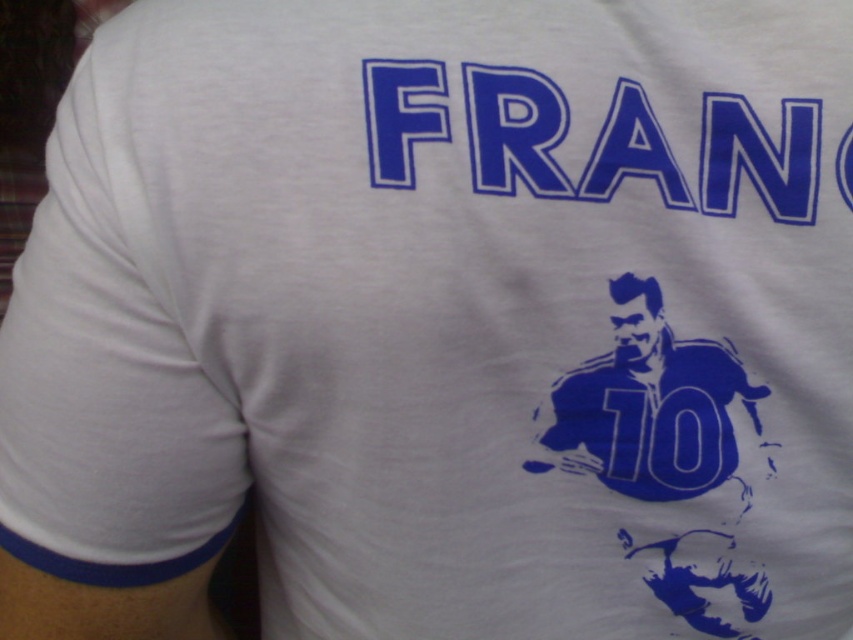
Question: Which point is farther to the camera?

Choices:
 (A) blue matte/ink soccer player at center
 (B) blue fabric text at upper center

Answer: (A)

Question: Is blue fabric text at upper center positioned in front of blue matte/ink soccer player at center?

Choices:
 (A) no
 (B) yes

Answer: (B)

Question: Is blue fabric text at upper center wider than blue matte/ink soccer player at center?

Choices:
 (A) no
 (B) yes

Answer: (B)

Question: Which of the following is the farthest from the observer?

Choices:
 (A) (631, 452)
 (B) (724, 157)

Answer: (A)

Question: Is blue fabric text at upper center further to camera compared to blue matte/ink soccer player at center?

Choices:
 (A) no
 (B) yes

Answer: (A)